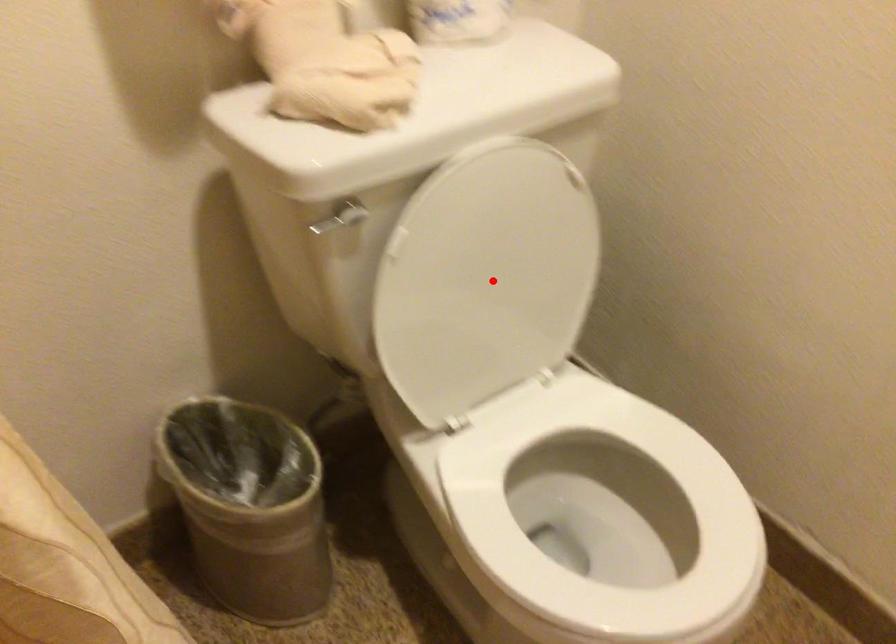
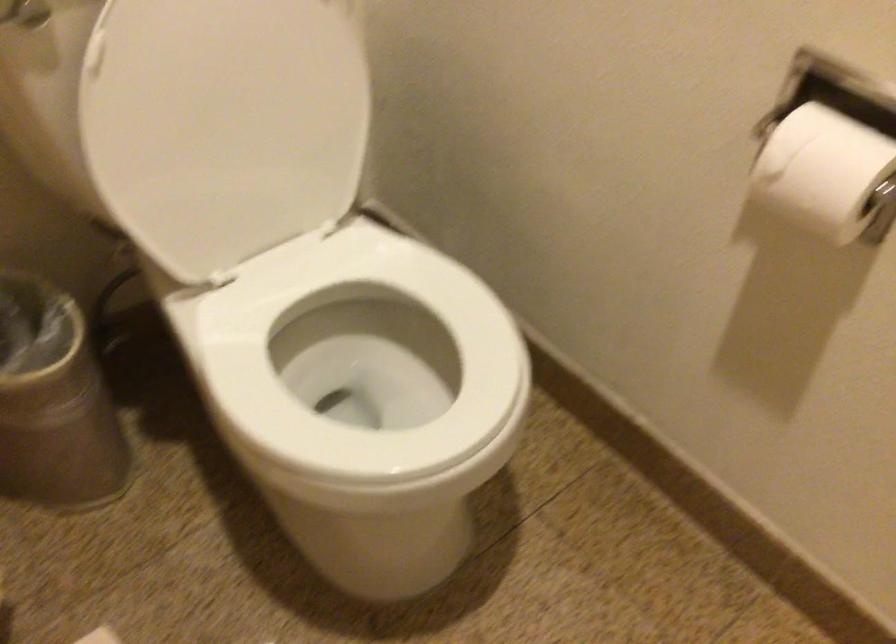
Find the pixel in the second image that matches the highlighted location in the first image.

(239, 114)